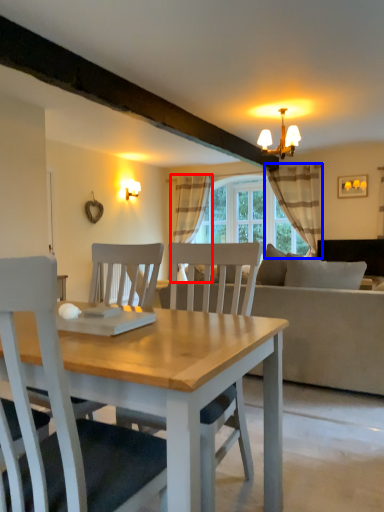
Question: Which of the following is the closest to the observer, curtain (highlighted by a red box) or curtain (highlighted by a blue box)?

Choices:
 (A) curtain
 (B) curtain

Answer: (B)